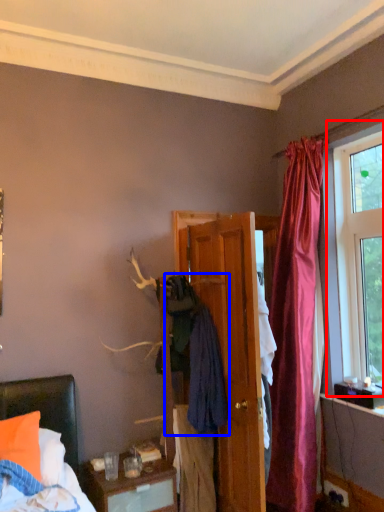
Question: Which of the following is the closest to the observer, window (highlighted by a red box) or clothing (highlighted by a blue box)?

Choices:
 (A) window
 (B) clothing

Answer: (B)